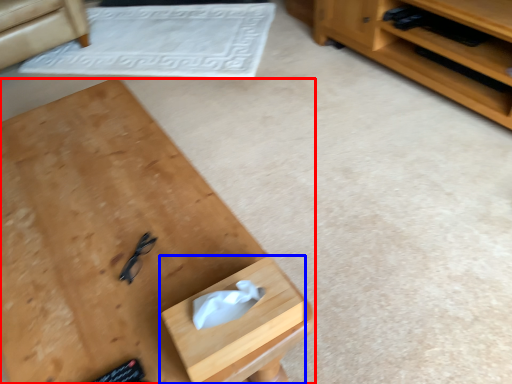
Question: Which point is further to the camera, desk (highlighted by a red box) or drawer (highlighted by a blue box)?

Choices:
 (A) desk
 (B) drawer

Answer: (B)